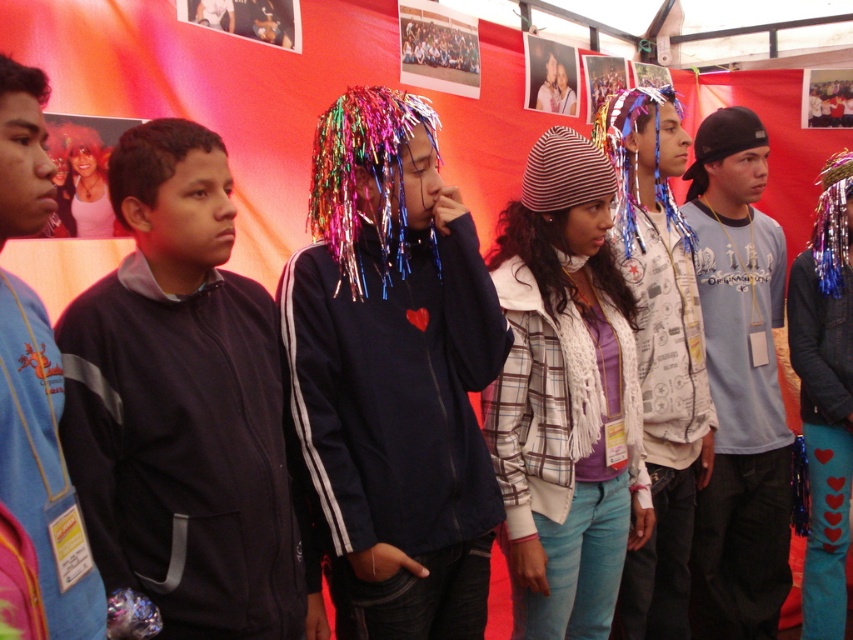
What do you see at coordinates (186, 408) in the screenshot? I see `black fleece jacket at left` at bounding box center [186, 408].

Locate an element on the screen. The height and width of the screenshot is (640, 853). black fleece jacket at left is located at coordinates (186, 408).

Which is in front, point (236, 445) or point (827, 349)?

Point (236, 445)

The width and height of the screenshot is (853, 640). Find the location of `black fleece jacket at left`. black fleece jacket at left is located at coordinates (x=186, y=408).

Does striped knit beanie at center have a smaller size compared to shiny metallic tinsel at center?

No.

Is striped knit beanie at center positioned in front of shiny metallic tinsel at center?

No, striped knit beanie at center is further to the viewer.

The height and width of the screenshot is (640, 853). What are the coordinates of `striped knit beanie at center` in the screenshot? It's located at (566, 396).

Which is more to the left, striped knit beanie at center or light blue t-shirt at center?

Positioned to the left is striped knit beanie at center.

In the scene shown: Does striped knit beanie at center have a lesser width compared to light blue t-shirt at center?

In fact, striped knit beanie at center might be wider than light blue t-shirt at center.

Does point (639, 404) lie in front of point (763, 518)?

Yes, point (639, 404) is in front of point (763, 518).

You are a GUI agent. You are given a task and a screenshot of the screen. Output one action in this format:
    pyautogui.click(x=<x>, y=<y>)
    Task: Click on the striped knit beanie at center
    
    Given the screenshot: What is the action you would take?
    pyautogui.click(x=566, y=396)